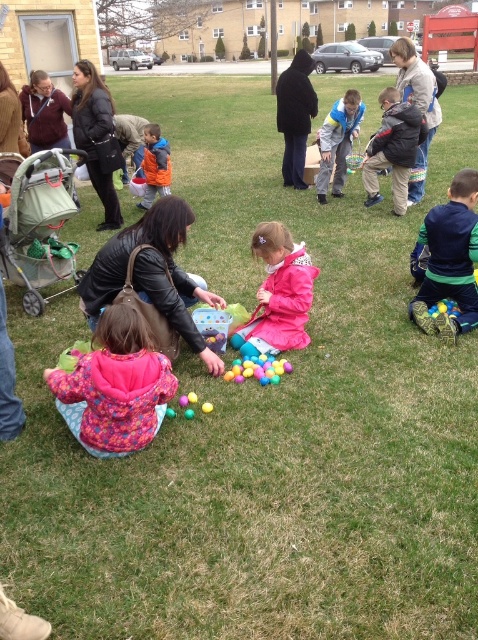
You are standing at the center of the image looking towards the lower right corner. Which object from the following list is located at the coordinates point 0.406, 0.941? Choose from the options below. The options are multicolored fabric pants at lower right, a red playground structure in the background, and several children seated on the grass.

The multicolored fabric pants at lower right are located at point (x=449, y=259).

You are organizing an Easter egg hunt and need to ensure there is enough space between two children sitting on the grass. The children are wearing a black leather jacket at center and an orange fleece jacket at center. Based on their jackets, which child might require more space due to their clothing?

The black leather jacket at center might be wider than the orange fleece jacket at center, so the child wearing the black leather jacket at center may need more space.

You are organizing an Easter egg hunt and need to ensure that the jackets are visible to participants. Which jacket, the fluffy pink jacket at lower left or the pink matte jacket at center, would be more noticeable from a distance due to its size?

The fluffy pink jacket at lower left is larger in size than the pink matte jacket at center, making it more noticeable from a distance.